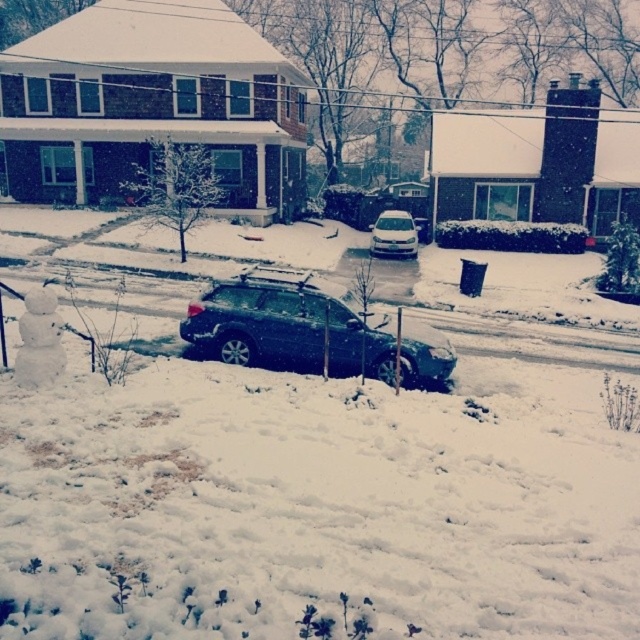
Question: Is satin black suv at center bigger than white matte car at center?

Choices:
 (A) yes
 (B) no

Answer: (B)

Question: Which point is closer to the camera?

Choices:
 (A) satin black suv at center
 (B) white matte car at center

Answer: (A)

Question: Can you confirm if satin black suv at center is positioned below white matte car at center?

Choices:
 (A) no
 (B) yes

Answer: (B)

Question: Which object appears farthest from the camera in this image?

Choices:
 (A) satin black suv at center
 (B) white matte car at center

Answer: (B)

Question: Which object appears closest to the camera in this image?

Choices:
 (A) white matte car at center
 (B) satin black suv at center

Answer: (B)

Question: Is the position of satin black suv at center more distant than that of white matte car at center?

Choices:
 (A) no
 (B) yes

Answer: (A)